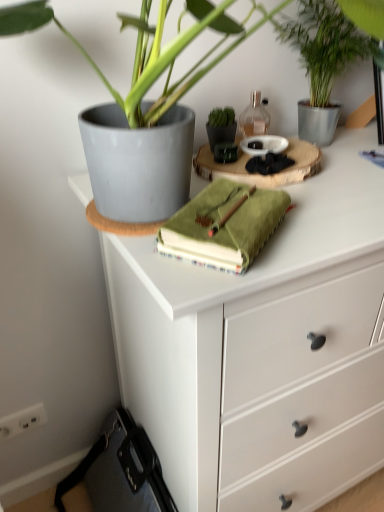
Question: Could you tell me if green matte flowerpot at center is turned towards green leafy plant at upper right?

Choices:
 (A) no
 (B) yes

Answer: (A)

Question: From the image's perspective, would you say green matte flowerpot at center is shown under green leafy plant at upper right?

Choices:
 (A) no
 (B) yes

Answer: (B)

Question: From a real-world perspective, is green matte flowerpot at center on top of green leafy plant at upper right?

Choices:
 (A) yes
 (B) no

Answer: (B)

Question: Can you confirm if green matte flowerpot at center is smaller than green leafy plant at upper right?

Choices:
 (A) yes
 (B) no

Answer: (A)

Question: Can you confirm if green matte flowerpot at center is taller than green leafy plant at upper right?

Choices:
 (A) yes
 (B) no

Answer: (B)

Question: From a real-world perspective, is green leafy plant at upper right positioned above or below translucent glass bottle at upper center?

Choices:
 (A) below
 (B) above

Answer: (B)

Question: Considering the positions of green leafy plant at upper right and translucent glass bottle at upper center in the image, is green leafy plant at upper right wider or thinner than translucent glass bottle at upper center?

Choices:
 (A) thin
 (B) wide

Answer: (B)

Question: Is green leafy plant at upper right inside the boundaries of translucent glass bottle at upper center, or outside?

Choices:
 (A) outside
 (B) inside

Answer: (A)

Question: In terms of size, does green leafy plant at upper right appear bigger or smaller than translucent glass bottle at upper center?

Choices:
 (A) small
 (B) big

Answer: (B)

Question: From the image's perspective, is white matte chest of drawers at upper center above or below green matte flowerpot at center?

Choices:
 (A) below
 (B) above

Answer: (A)

Question: From a real-world perspective, is white matte chest of drawers at upper center above or below green matte flowerpot at center?

Choices:
 (A) below
 (B) above

Answer: (A)

Question: From their relative heights in the image, would you say white matte chest of drawers at upper center is taller or shorter than green matte flowerpot at center?

Choices:
 (A) tall
 (B) short

Answer: (A)

Question: In terms of width, does white matte chest of drawers at upper center look wider or thinner when compared to green matte flowerpot at center?

Choices:
 (A) wide
 (B) thin

Answer: (A)

Question: Would you say translucent glass bottle at upper center is to the left or to the right of white matte chest of drawers at upper center in the picture?

Choices:
 (A) left
 (B) right

Answer: (A)

Question: From the image's perspective, is translucent glass bottle at upper center located above or below white matte chest of drawers at upper center?

Choices:
 (A) below
 (B) above

Answer: (B)